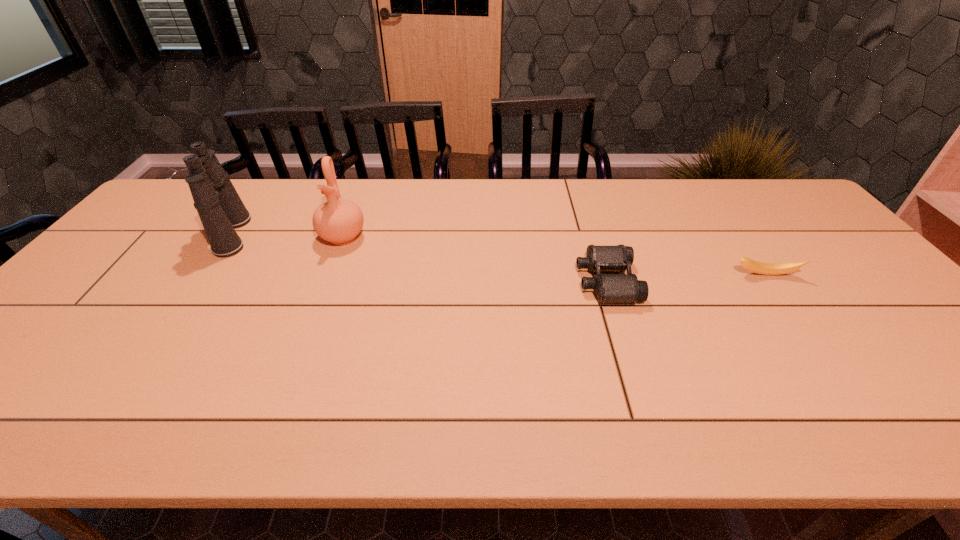
What are the coordinates of `the taller binoculars` in the screenshot? It's located at coord(220,208).

At what (x,y) coordinates should I click in order to perform the action: click on the leftmost object. Please return your answer as a coordinate pair (x, y). Looking at the image, I should click on (220, 208).

Identify the location of the third object from right to left. The height and width of the screenshot is (540, 960). (339, 221).

I want to click on the shorter binoculars, so click(x=609, y=288).

Locate an element on the screen. The image size is (960, 540). the second object from right to left is located at coordinates (609, 288).

This screenshot has width=960, height=540. What are the coordinates of `banana` in the screenshot? It's located at (x=757, y=267).

The height and width of the screenshot is (540, 960). I want to click on free location located 0.190m on the right of the taller binoculars, so click(315, 234).

Find the location of a particular element. The image size is (960, 540). vacant space located 0.100m on the spout of the pottery is located at coordinates (328, 274).

The height and width of the screenshot is (540, 960). What are the coordinates of `free space located through the eyepieces of the shorter binoculars` in the screenshot? It's located at (482, 281).

Locate an element on the screen. The image size is (960, 540). blank space located through the eyepieces of the shorter binoculars is located at coordinates (541, 281).